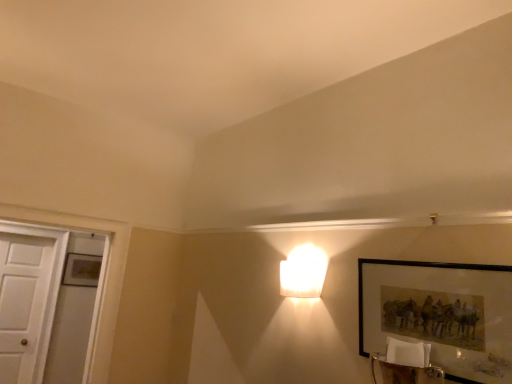
Question: Considering the relative sizes of matte black picture frame at lower right and white wooden door at left in the image provided, is matte black picture frame at lower right taller than white wooden door at left?

Choices:
 (A) no
 (B) yes

Answer: (A)

Question: Considering the relative positions of matte black picture frame at lower right and white wooden door at left in the image provided, is matte black picture frame at lower right behind white wooden door at left?

Choices:
 (A) yes
 (B) no

Answer: (B)

Question: Is white wooden door at left inside matte black picture frame at lower right?

Choices:
 (A) yes
 (B) no

Answer: (B)

Question: Considering the relative sizes of matte black picture frame at lower right and white wooden door at left in the image provided, is matte black picture frame at lower right shorter than white wooden door at left?

Choices:
 (A) yes
 (B) no

Answer: (A)

Question: Is the position of matte black picture frame at lower right less distant than that of white wooden door at left?

Choices:
 (A) no
 (B) yes

Answer: (B)

Question: Is white frosted glass lamp at upper center wider or thinner than white wooden door at left?

Choices:
 (A) wide
 (B) thin

Answer: (A)

Question: From a real-world perspective, is white frosted glass lamp at upper center positioned above or below white wooden door at left?

Choices:
 (A) below
 (B) above

Answer: (B)

Question: From the image's perspective, is white frosted glass lamp at upper center located above or below white wooden door at left?

Choices:
 (A) below
 (B) above

Answer: (B)

Question: Based on their positions, is white frosted glass lamp at upper center located to the left or right of white wooden door at left?

Choices:
 (A) right
 (B) left

Answer: (A)

Question: From their relative heights in the image, would you say white wooden door at left is taller or shorter than white frosted glass lamp at upper center?

Choices:
 (A) tall
 (B) short

Answer: (A)

Question: From the image's perspective, relative to white frosted glass lamp at upper center, is white wooden door at left above or below?

Choices:
 (A) above
 (B) below

Answer: (B)

Question: Looking at the image, does white wooden door at left seem bigger or smaller compared to white frosted glass lamp at upper center?

Choices:
 (A) big
 (B) small

Answer: (A)

Question: Is point (36, 264) positioned closer to the camera than point (308, 281)?

Choices:
 (A) farther
 (B) closer

Answer: (A)

Question: In terms of width, does matte black picture frame at lower right look wider or thinner when compared to white wooden door at left?

Choices:
 (A) thin
 (B) wide

Answer: (A)

Question: Is matte black picture frame at lower right situated inside white wooden door at left or outside?

Choices:
 (A) outside
 (B) inside

Answer: (A)